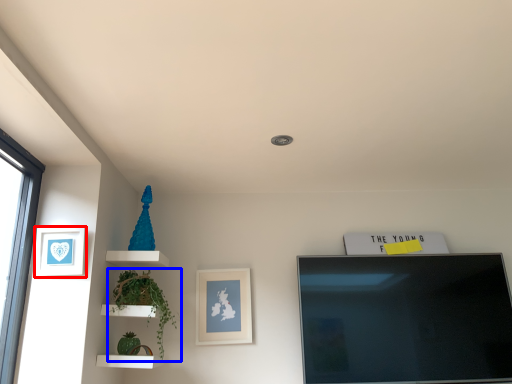
Question: Which of the following is the closest to the observer, picture frame (highlighted by a red box) or plant (highlighted by a blue box)?

Choices:
 (A) picture frame
 (B) plant

Answer: (A)